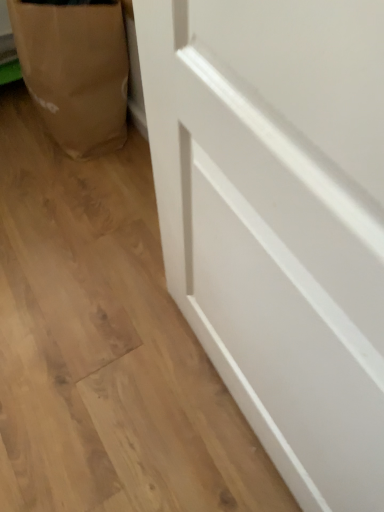
Question: In the image, is brown paper bag at lower left positioned in front of or behind white smooth door at lower right?

Choices:
 (A) front
 (B) behind

Answer: (B)

Question: In terms of width, does brown paper bag at lower left look wider or thinner when compared to white smooth door at lower right?

Choices:
 (A) wide
 (B) thin

Answer: (B)

Question: Is brown paper bag at lower left situated inside white smooth door at lower right or outside?

Choices:
 (A) inside
 (B) outside

Answer: (B)

Question: Would you say white smooth door at lower right is to the left or to the right of brown paper bag at lower left in the picture?

Choices:
 (A) left
 (B) right

Answer: (B)

Question: From the image's perspective, is white smooth door at lower right located above or below brown paper bag at lower left?

Choices:
 (A) below
 (B) above

Answer: (A)

Question: From a real-world perspective, is white smooth door at lower right positioned above or below brown paper bag at lower left?

Choices:
 (A) above
 (B) below

Answer: (B)

Question: Is white smooth door at lower right spatially inside brown paper bag at lower left, or outside of it?

Choices:
 (A) inside
 (B) outside

Answer: (B)